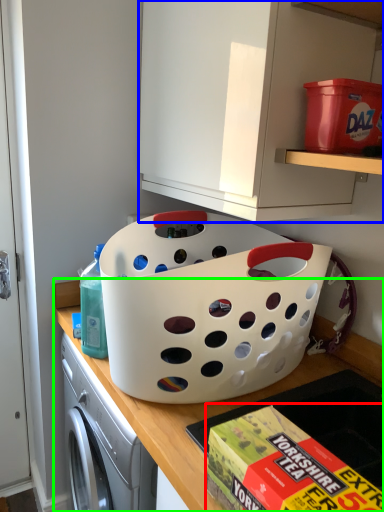
Question: Considering the real-world distances, which object is closest to box (highlighted by a red box)? cabinetry (highlighted by a blue box) or countertop (highlighted by a green box).

Choices:
 (A) cabinetry
 (B) countertop

Answer: (B)